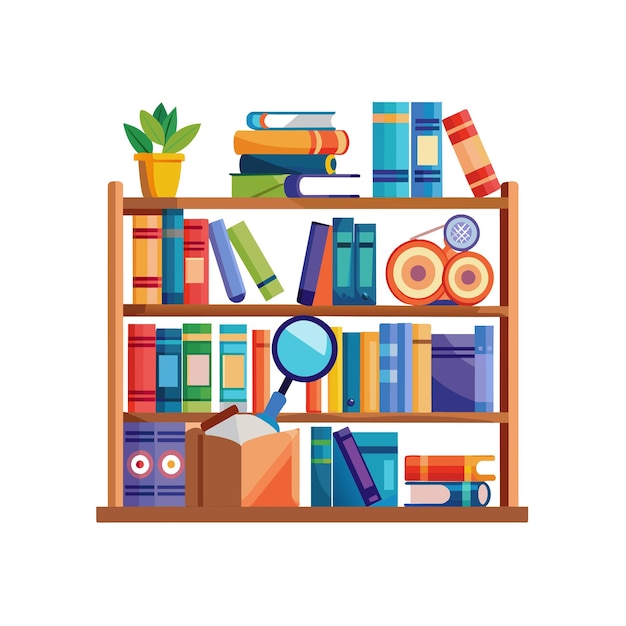
Find the location of a particular element. The height and width of the screenshot is (626, 626). book propped at an angle is located at coordinates (360, 466), (305, 279), (262, 270), (230, 270), (475, 163).